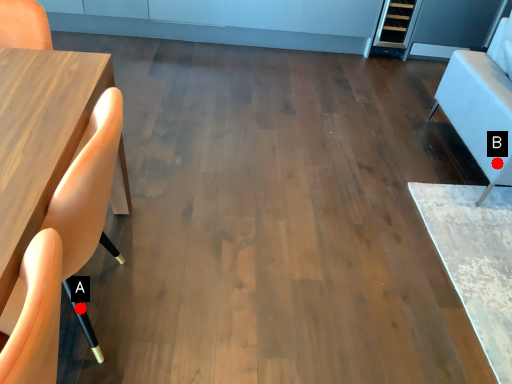
Question: Two points are circled on the image, labeled by A and B beside each circle. Which point is closer to the camera taking this photo?

Choices:
 (A) A is closer
 (B) B is closer

Answer: (A)